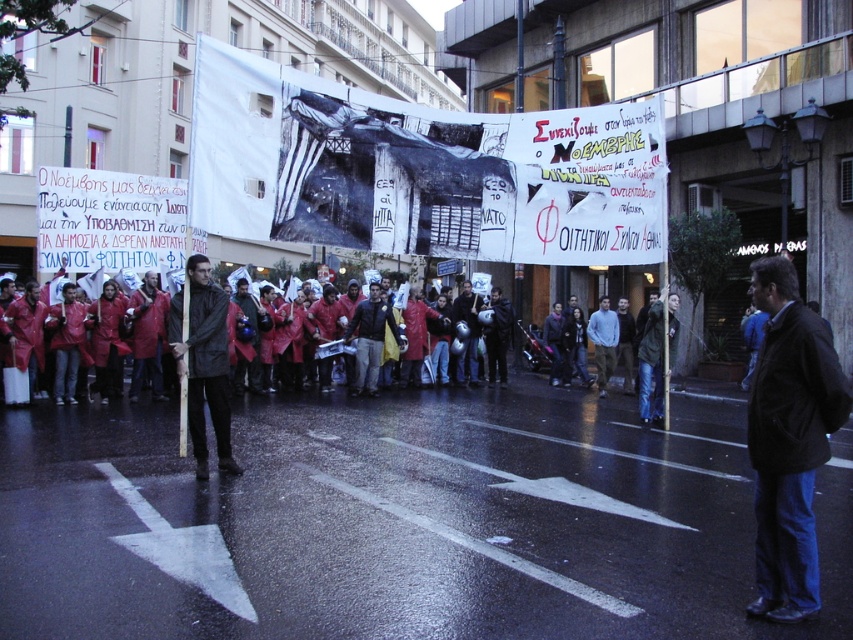
Question: Which object is the farthest from the black leather jacket at lower right?

Choices:
 (A) black and white poster at center
 (B) metallic helmet at center
 (C) dark brown leather jacket at center

Answer: (B)

Question: Which of these objects is positioned farthest from the light blue denim shirt at center?

Choices:
 (A) black leather jacket at lower right
 (B) black and white poster at center
 (C) dark green fabric coat at center

Answer: (A)

Question: Considering the real-world distances, which object is farthest from the dark green fabric coat at center?

Choices:
 (A) black and white poster at center
 (B) dark brown leather jacket at center
 (C) black leather jacket at lower right
 (D) light blue denim shirt at center

Answer: (D)

Question: Does black leather jacket at lower right have a larger size compared to metallic helmet at center?

Choices:
 (A) no
 (B) yes

Answer: (A)

Question: Considering the relative positions of black and white poster at center and black leather jacket at lower right in the image provided, where is black and white poster at center located with respect to black leather jacket at lower right?

Choices:
 (A) above
 (B) below

Answer: (A)

Question: Does dark brown leather jacket at center appear on the left side of light blue denim shirt at center?

Choices:
 (A) yes
 (B) no

Answer: (A)